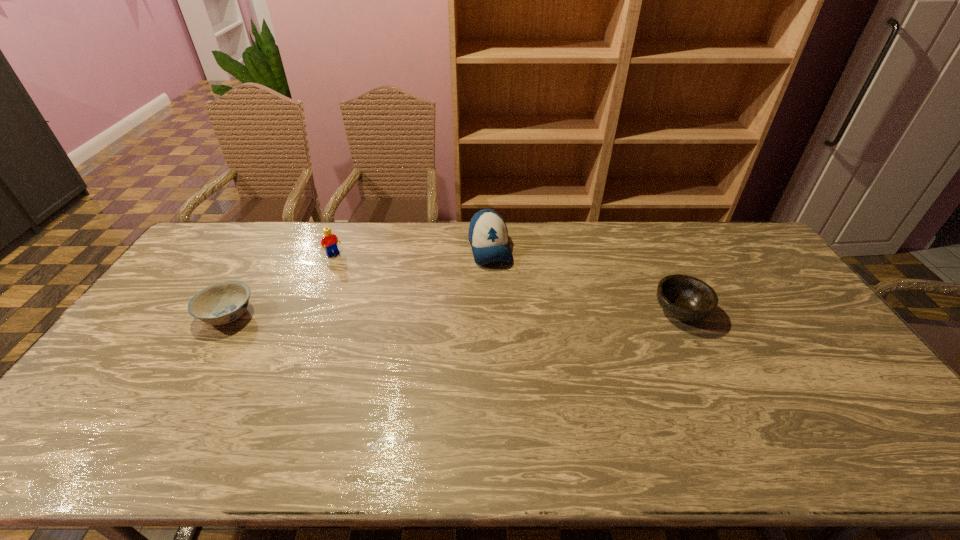
The height and width of the screenshot is (540, 960). What are the coordinates of `vacant space that's between the left bowl and the rightmost object` in the screenshot? It's located at [454, 313].

Find the location of a particular element. free space between the rightmost object and the third object from left to right is located at coordinates (586, 280).

This screenshot has width=960, height=540. I want to click on free space between the rightmost object and the second object from right to left, so click(586, 280).

Identify the location of vacant area that lies between the baseball cap and the leftmost object. (359, 281).

The height and width of the screenshot is (540, 960). Find the location of `empty space that is in between the third object from left to right and the leftmost object`. empty space that is in between the third object from left to right and the leftmost object is located at coordinates (359, 281).

Locate an element on the screen. unoccupied position between the baseball cap and the right bowl is located at coordinates (586, 280).

Find the location of a particular element. Image resolution: width=960 pixels, height=540 pixels. free space between the leftmost object and the right bowl is located at coordinates (454, 313).

I want to click on empty space that is in between the third object from right to left and the right bowl, so click(507, 282).

The width and height of the screenshot is (960, 540). In order to click on free space between the right bowl and the leftmost object in this screenshot , I will do `click(454, 313)`.

The width and height of the screenshot is (960, 540). I want to click on free space that is in between the Lego and the baseball cap, so click(412, 251).